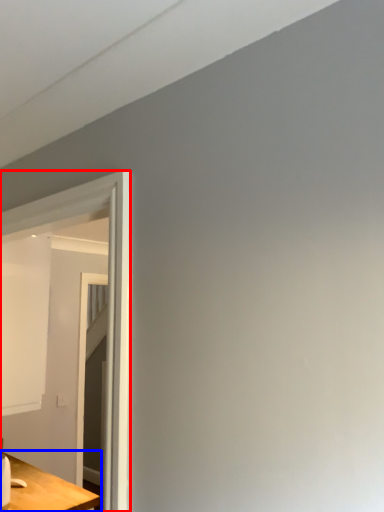
Question: Which of the following is the farthest to the observer, glass door (highlighted by a red box) or table (highlighted by a blue box)?

Choices:
 (A) glass door
 (B) table

Answer: (B)